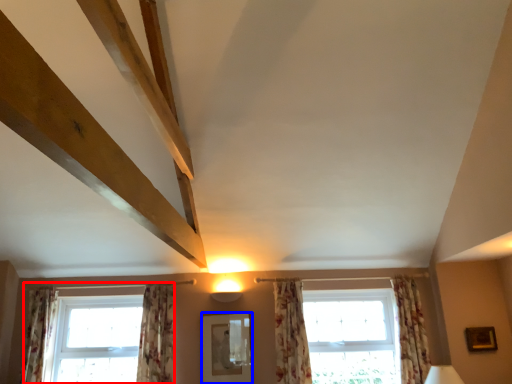
Question: Which object is further to the camera taking this photo, window (highlighted by a red box) or mirror (highlighted by a blue box)?

Choices:
 (A) window
 (B) mirror

Answer: (A)